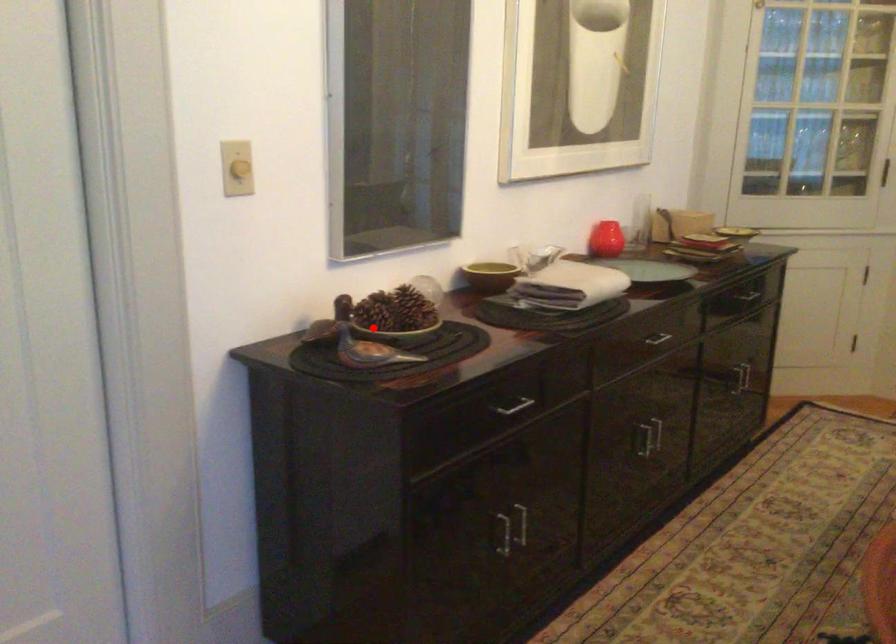
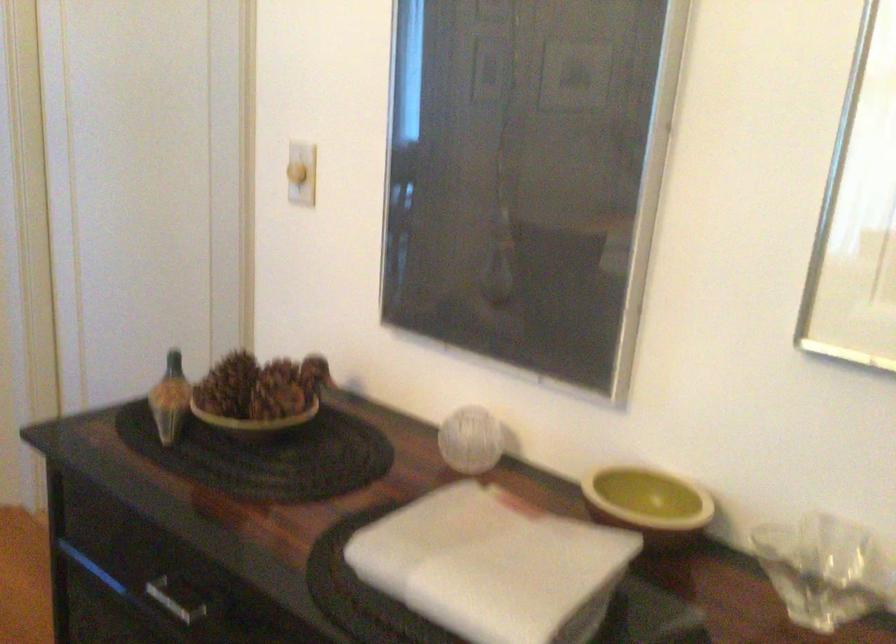
Question: I am providing you with two images of the same scene from different viewpoints. Given a red point in image1, look at the same physical point in image2. Is it:

Choices:
 (A) Closer to the viewpoint
 (B) Farther from the viewpoint

Answer: (A)